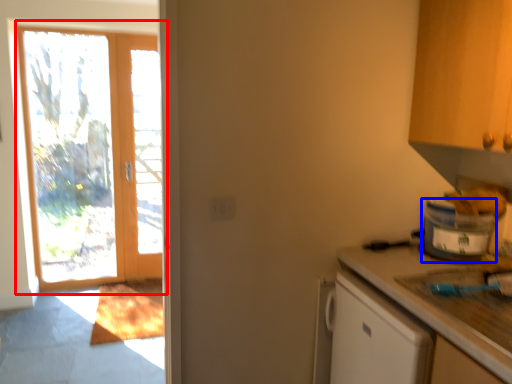
Question: Which of the following is the farthest to the observer, door (highlighted by a red box) or appliance (highlighted by a blue box)?

Choices:
 (A) door
 (B) appliance

Answer: (A)